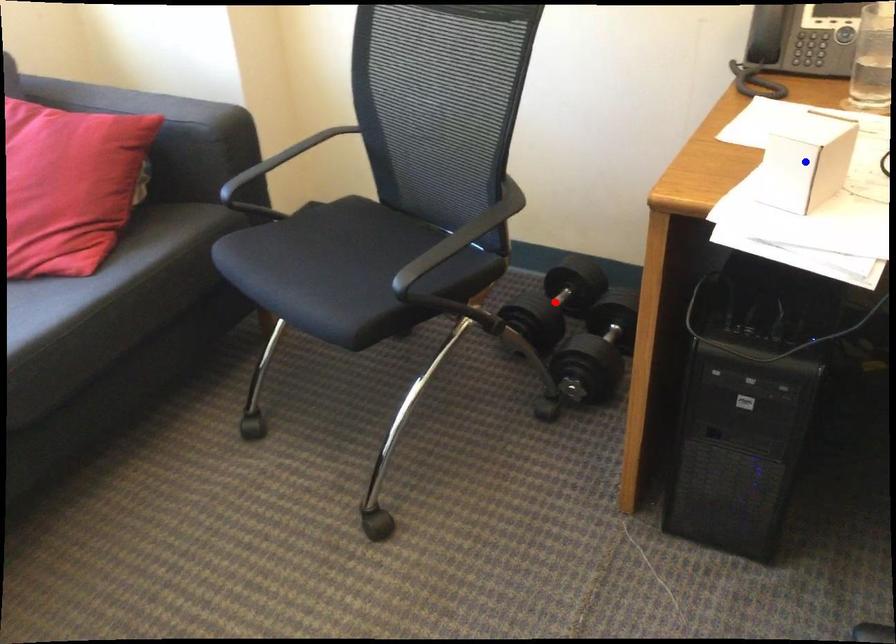
Question: Which of the two points in the image is closer to the camera?

Choices:
 (A) Blue point is closer.
 (B) Red point is closer.

Answer: (A)